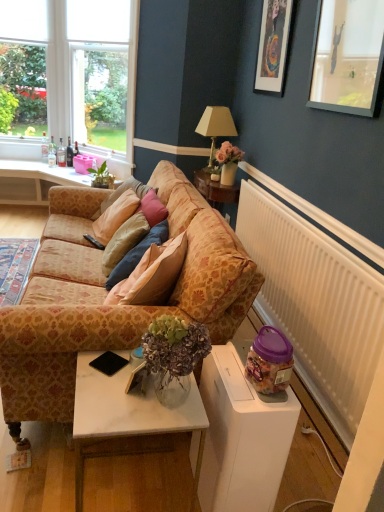
Locate an element on the screen. The width and height of the screenshot is (384, 512). free point above white marble table at lower center (from a real-world perspective) is located at coordinates (127, 388).